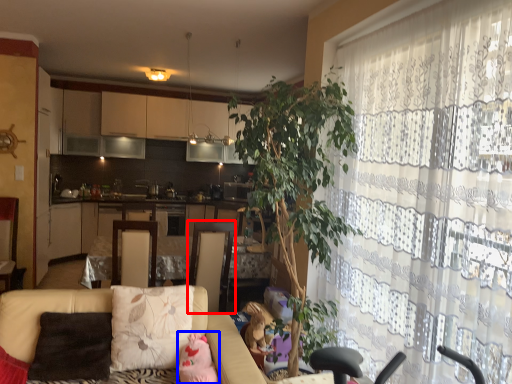
Question: Which point is further to the camera, swivel chair (highlighted by a red box) or toy (highlighted by a blue box)?

Choices:
 (A) swivel chair
 (B) toy

Answer: (A)